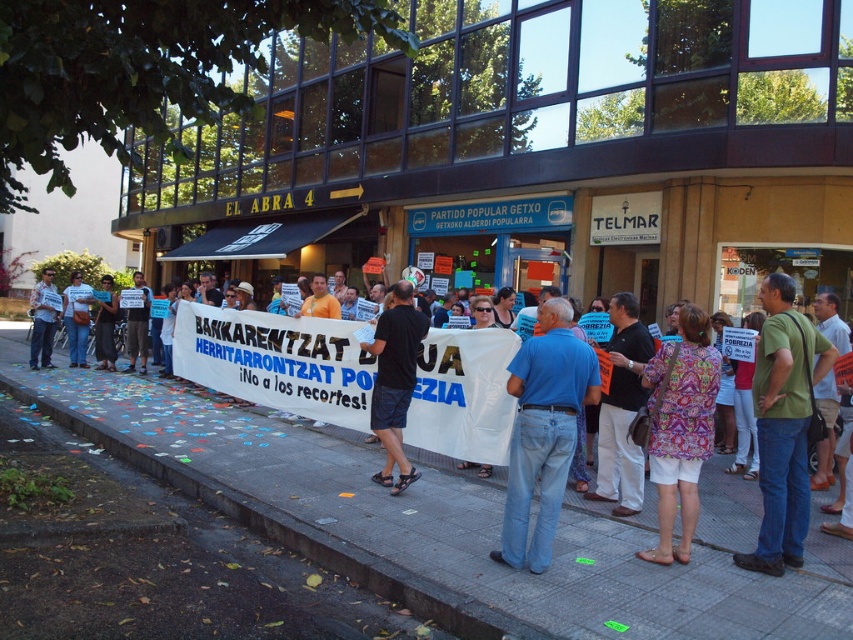
Question: Can you confirm if gray concrete pavement at lower center is wider than matte black shirt at left?

Choices:
 (A) no
 (B) yes

Answer: (A)

Question: From the image, what is the correct spatial relationship of blue denim jeans at center in relation to matte blue shirt at center?

Choices:
 (A) below
 (B) above

Answer: (A)

Question: Which object is positioned closest to the gray concrete pavement at lower center?

Choices:
 (A) matte black shirt at left
 (B) paisley fabric shirt at center
 (C) black fabric shorts at center
 (D) blue denim jeans at center

Answer: (C)

Question: Considering the real-world distances, which object is farthest from the gray concrete pavement at lower center?

Choices:
 (A) blue denim jeans at center
 (B) black fabric shorts at center
 (C) matte black shirt at left
 (D) green cotton shirt at center

Answer: (C)

Question: Which object is positioned farthest from the matte blue shirt at center?

Choices:
 (A) green cotton shirt at center
 (B) paisley fabric shirt at center
 (C) matte black shirt at left

Answer: (A)

Question: Observing the image, what is the correct spatial positioning of green cotton shirt at center in reference to matte blue shirt at center?

Choices:
 (A) right
 (B) left

Answer: (A)